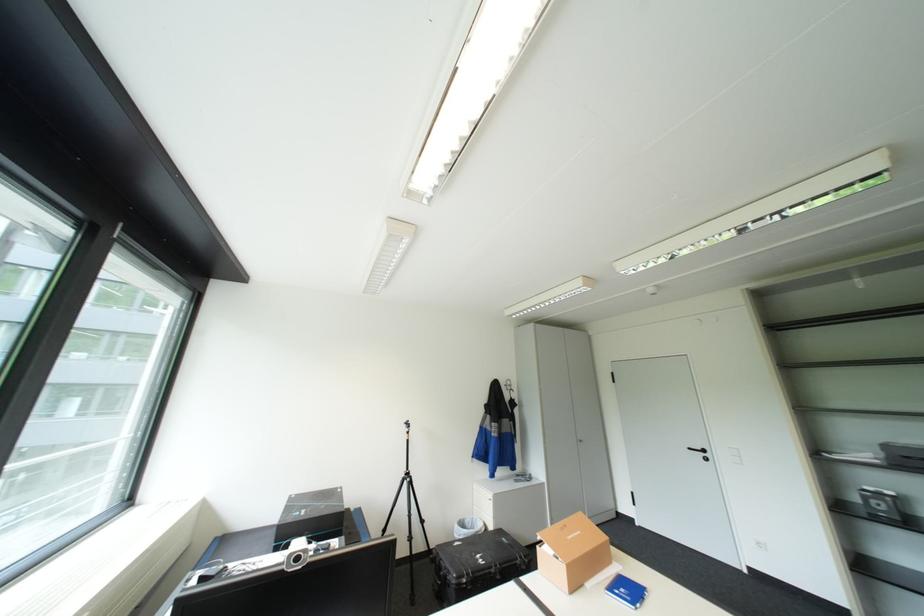
At what (x,y) coordinates should I click in order to perform the action: click on black case handle. Please return your answer as a coordinate pair (x, y). Image resolution: width=924 pixels, height=616 pixels. Looking at the image, I should click on (477, 565).